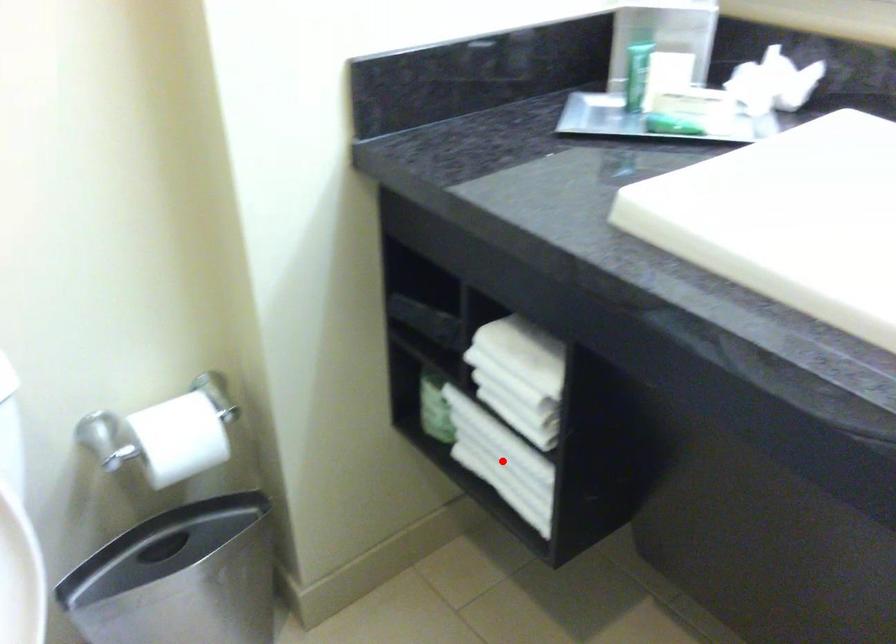
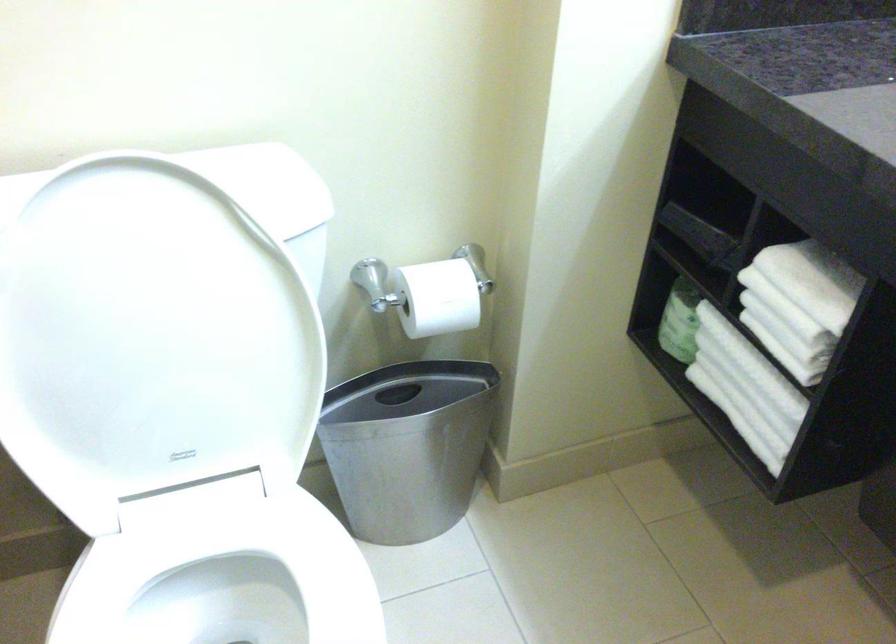
In the second image, find the point that corresponds to the highlighted location in the first image.

(745, 388)